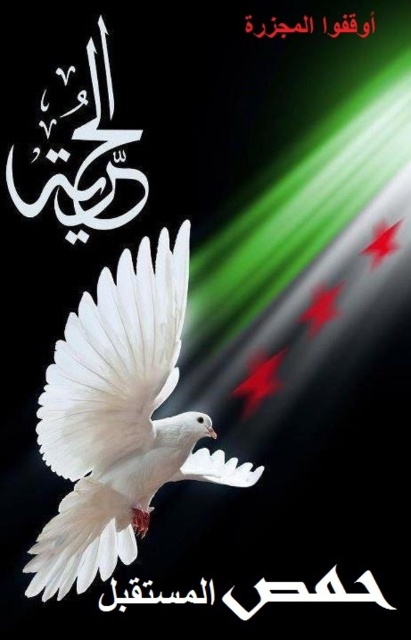
Which is in front, point (30, 595) or point (304, 592)?

Point (30, 595) is in front.

Is point (59, 577) in front of point (291, 595)?

That is True.

Where is `matte white dove at center`? The width and height of the screenshot is (411, 640). matte white dove at center is located at coordinates pos(119,419).